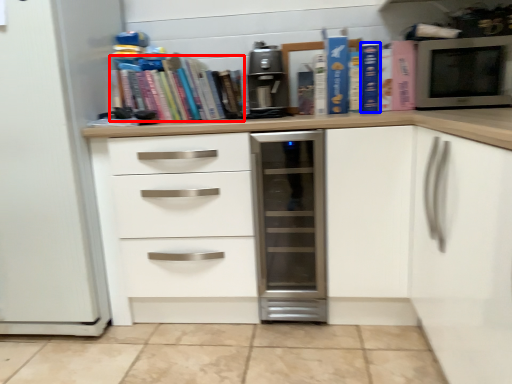
Question: Which point is further to the camera, book (highlighted by a red box) or paperback book (highlighted by a blue box)?

Choices:
 (A) book
 (B) paperback book

Answer: (A)